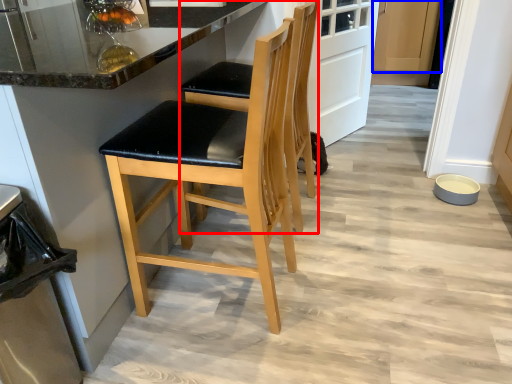
Question: Which object is closer to the camera taking this photo, chair (highlighted by a red box) or cabinetry (highlighted by a blue box)?

Choices:
 (A) chair
 (B) cabinetry

Answer: (A)